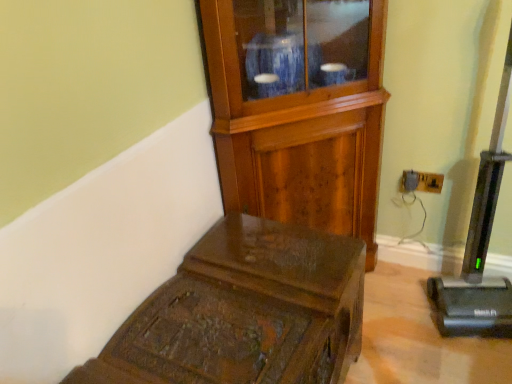
Measure the distance between wooden trunk at lower left and camera.

wooden trunk at lower left and camera are 35.15 inches apart from each other.

Identify the location of black plastic vacuum cleaner at right. 480,246.

This screenshot has width=512, height=384. Identify the location of wooden side cabinet at center. (298, 109).

From the image's perspective, which one is positioned lower, wooden side cabinet at center or black plastic vacuum cleaner at right?

From the image's view, black plastic vacuum cleaner at right is below.

Consider the image. Considering the relative sizes of wooden side cabinet at center and black plastic vacuum cleaner at right in the image provided, is wooden side cabinet at center smaller than black plastic vacuum cleaner at right?

No, wooden side cabinet at center is not smaller than black plastic vacuum cleaner at right.

Identify the location of equipment that appears below the wooden side cabinet at center (from a real-world perspective). (480, 246).

From a real-world perspective, which is physically above, wooden side cabinet at center or black plastic vacuum cleaner at right?

wooden side cabinet at center is physically above.

From a real-world perspective, is wooden side cabinet at center positioned above or below wooden trunk at lower left?

Clearly, from a real-world perspective, wooden side cabinet at center is above wooden trunk at lower left.

Is the surface of wooden side cabinet at center in direct contact with wooden trunk at lower left?

No, wooden side cabinet at center is not next to wooden trunk at lower left.

Is wooden side cabinet at center thinner than wooden trunk at lower left?

Yes.

Is black plastic vacuum cleaner at right to the left or to the right of wooden trunk at lower left in the image?

Clearly, black plastic vacuum cleaner at right is on the right of wooden trunk at lower left in the image.

From a real-world perspective, between black plastic vacuum cleaner at right and wooden trunk at lower left, who is vertically lower?

wooden trunk at lower left.

From the picture: Is black plastic vacuum cleaner at right thinner than wooden trunk at lower left?

Correct, the width of black plastic vacuum cleaner at right is less than that of wooden trunk at lower left.

Is black plastic vacuum cleaner at right facing towards wooden trunk at lower left?

No, black plastic vacuum cleaner at right is not aimed at wooden trunk at lower left.

From a real-world perspective, relative to black plastic vacuum cleaner at right, is wooden trunk at lower left vertically above or below?

From a real-world perspective, wooden trunk at lower left is physically below black plastic vacuum cleaner at right.

Between wooden trunk at lower left and black plastic vacuum cleaner at right, which one has less height?

Standing shorter between the two is wooden trunk at lower left.

Is wooden trunk at lower left further to the viewer compared to black plastic vacuum cleaner at right?

No, the depth of wooden trunk at lower left is less than that of black plastic vacuum cleaner at right.

From the image's perspective, which object appears higher, wooden trunk at lower left or black plastic vacuum cleaner at right?

black plastic vacuum cleaner at right.

From the image's perspective, is wooden trunk at lower left positioned above or below wooden side cabinet at center?

wooden trunk at lower left is situated lower than wooden side cabinet at center in the image.

Would you say wooden trunk at lower left is to the left or to the right of wooden side cabinet at center in the picture?

wooden trunk at lower left is positioned on wooden side cabinet at center's left side.

Does wooden trunk at lower left have a greater width compared to wooden side cabinet at center?

Correct, the width of wooden trunk at lower left exceeds that of wooden side cabinet at center.

Is black plastic vacuum cleaner at right behind wooden side cabinet at center?

No, the depth of black plastic vacuum cleaner at right is less than that of wooden side cabinet at center.

Considering the sizes of objects black plastic vacuum cleaner at right and wooden side cabinet at center in the image provided, who is bigger, black plastic vacuum cleaner at right or wooden side cabinet at center?

With larger size is wooden side cabinet at center.

Is point (446, 317) closer or farther from the camera than point (246, 105)?

Point (446, 317).

Is black plastic vacuum cleaner at right positioned with its back to wooden side cabinet at center?

No, black plastic vacuum cleaner at right is not facing the opposite direction of wooden side cabinet at center.

At what (x,y) coordinates should I click in order to perform the action: click on equipment that is in front of the wooden side cabinet at center. Please return your answer as a coordinate pair (x, y). The height and width of the screenshot is (384, 512). Looking at the image, I should click on (480, 246).

Identify the location of furniture that appears below the wooden side cabinet at center (from a real-world perspective). This screenshot has height=384, width=512. (245, 312).

Considering their positions, is wooden side cabinet at center positioned closer to wooden trunk at lower left than black plastic vacuum cleaner at right?

wooden side cabinet at center.

Considering their positions, is wooden trunk at lower left positioned further to black plastic vacuum cleaner at right than wooden side cabinet at center?

Based on the image, wooden trunk at lower left appears to be further to black plastic vacuum cleaner at right.

Which object lies nearer to the anchor point black plastic vacuum cleaner at right, wooden side cabinet at center or wooden trunk at lower left?

Based on the image, wooden side cabinet at center appears to be nearer to black plastic vacuum cleaner at right.

Based on their spatial positions, is black plastic vacuum cleaner at right or wooden side cabinet at center closer to wooden trunk at lower left?

wooden side cabinet at center is positioned closer to the anchor wooden trunk at lower left.

Estimate the real-world distances between objects in this image. Which object is closer to wooden side cabinet at center, wooden trunk at lower left or black plastic vacuum cleaner at right?

The object closer to wooden side cabinet at center is wooden trunk at lower left.

Looking at this image, based on their spatial positions, is black plastic vacuum cleaner at right or wooden trunk at lower left further from wooden side cabinet at center?

Based on the image, black plastic vacuum cleaner at right appears to be further to wooden side cabinet at center.

Find the location of a particular element. The height and width of the screenshot is (384, 512). side cabinet situated between wooden trunk at lower left and black plastic vacuum cleaner at right from left to right is located at coordinates (298, 109).